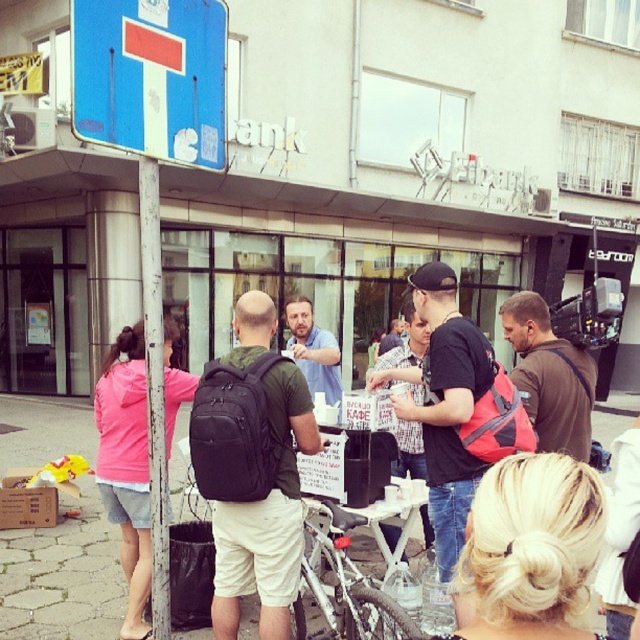
You are standing at the center of the scene and want to pick up the black matte backpack at center without moving. Can you reach it from your current position?

The black matte backpack at center is 2.96 meters away from the viewer, so you cannot reach it without moving closer.

You are standing at point (424, 515) and want to walk towards point (428, 305). Is there any obstacle between you and your destination?

Point (428, 305) is in front of point (424, 515), so there is no obstacle between you and your destination.

Based on the photo, in the scene described, there is a point located at coordinates (548, 376). Which object from the list below is this point part of? Choose the correct object label from the provided options. Objects available are the black trash bin, the brown fabric backpack at center right, the pink jacket, and the green t shirt.

The point at coordinates (548, 376) is part of the brown fabric backpack at center right.